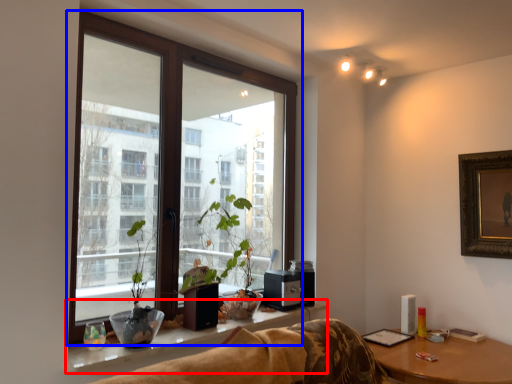
Question: Which point is closer to the camera, window sill (highlighted by a red box) or window (highlighted by a blue box)?

Choices:
 (A) window sill
 (B) window

Answer: (A)